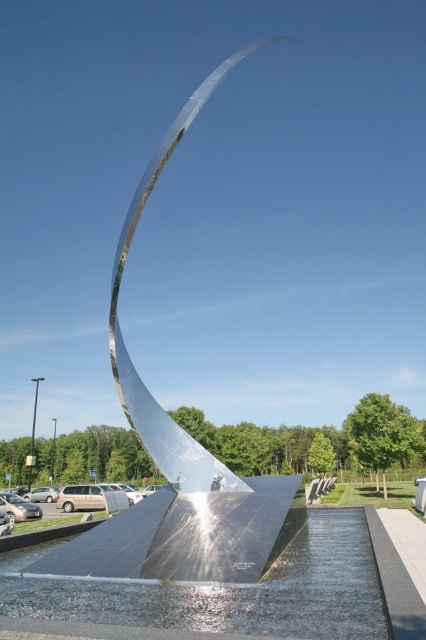
You are an artist planning to photograph the polished metallic sculpture at center and the clear glass water at center from a distance. Based on their widths, which object would appear wider in the photo?

The polished metallic sculpture at center would appear wider in the photo because its width surpasses that of the clear glass water at center.

You are standing in front of the sculpture and want to take a photo of both the polished metallic sculpture at center and the clear glass water at center. Which object should you position to your right side to capture both in the frame?

To capture both the polished metallic sculpture at center and the clear glass water at center in the frame, position the clear glass water at center to your right side since the polished metallic sculpture at center is to the left of it.